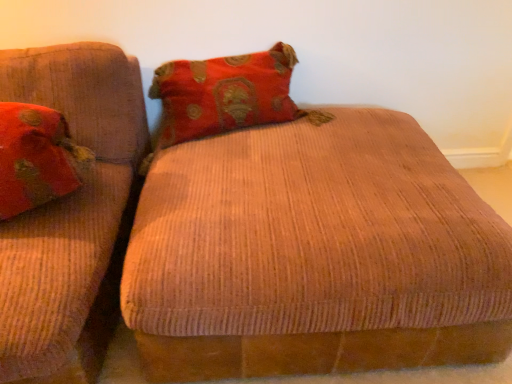
Question: Is corduroy fabric ottoman at center at the left side of matte red pillow at left?

Choices:
 (A) yes
 (B) no

Answer: (B)

Question: Considering the relative sizes of corduroy fabric ottoman at center and matte red pillow at left in the image provided, is corduroy fabric ottoman at center taller than matte red pillow at left?

Choices:
 (A) no
 (B) yes

Answer: (B)

Question: From a real-world perspective, does corduroy fabric ottoman at center stand above matte red pillow at left?

Choices:
 (A) yes
 (B) no

Answer: (B)

Question: Can you confirm if corduroy fabric ottoman at center is smaller than matte red pillow at left?

Choices:
 (A) yes
 (B) no

Answer: (B)

Question: Does corduroy fabric ottoman at center have a greater width compared to matte red pillow at left?

Choices:
 (A) yes
 (B) no

Answer: (A)

Question: Is corduroy fabric ottoman at center to the right of matte red pillow at left from the viewer's perspective?

Choices:
 (A) no
 (B) yes

Answer: (B)

Question: Is the surface of matte red pillow at left in direct contact with corduroy fabric ottoman at center?

Choices:
 (A) no
 (B) yes

Answer: (A)

Question: Does matte red pillow at left come behind corduroy fabric ottoman at center?

Choices:
 (A) no
 (B) yes

Answer: (B)

Question: Considering the relative positions of matte red pillow at left and corduroy fabric ottoman at center in the image provided, is matte red pillow at left in front of corduroy fabric ottoman at center?

Choices:
 (A) no
 (B) yes

Answer: (A)

Question: From a real-world perspective, is matte red pillow at left located higher than corduroy fabric ottoman at center?

Choices:
 (A) no
 (B) yes

Answer: (B)

Question: Is matte red pillow at left not close to corduroy fabric ottoman at center?

Choices:
 (A) no
 (B) yes

Answer: (A)

Question: Can we say matte red pillow at left lies outside corduroy fabric ottoman at center?

Choices:
 (A) no
 (B) yes

Answer: (B)

Question: Considering the positions of corduroy fabric ottoman at center and matte red pillow at left in the image, is corduroy fabric ottoman at center wider or thinner than matte red pillow at left?

Choices:
 (A) thin
 (B) wide

Answer: (B)